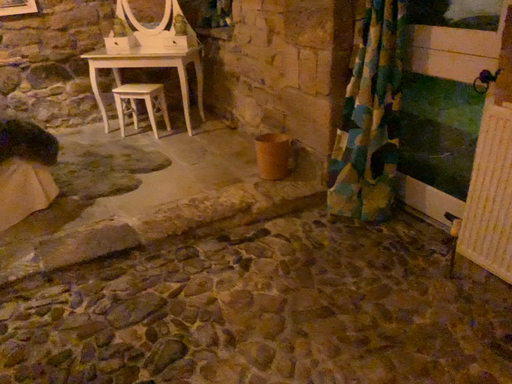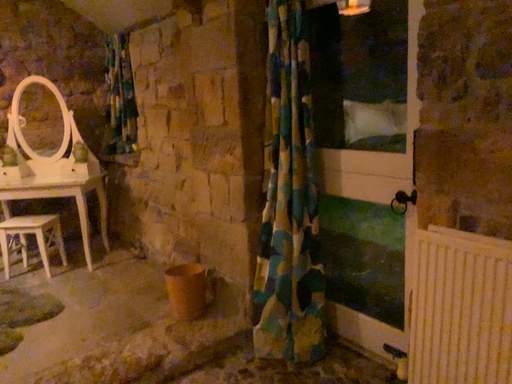
Question: How did the camera likely rotate when shooting the video?

Choices:
 (A) rotated downward
 (B) rotated upward

Answer: (B)